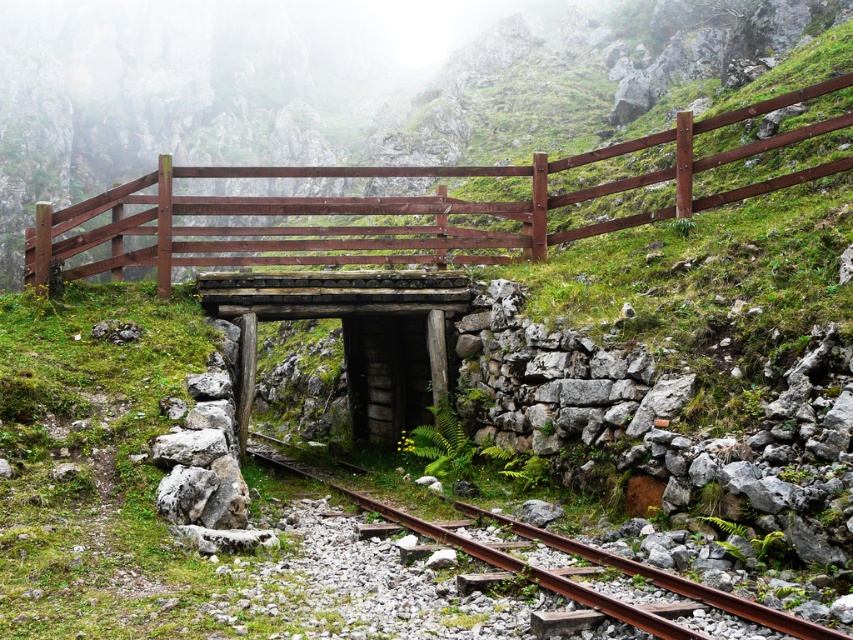
You are a hiker who wants to cross the wooden bridge in the center. The brown wooden fence at center and the rusty metal train track at center are both in your path. Which one is higher and must be navigated first?

The brown wooden fence at center is above the rusty metal train track at center, so you must navigate the brown wooden fence at center first before reaching the train track.

You are a hiker who wants to cross the wooden bridge but needs to know if you can step over the brown wooden fence at center without touching the rusty metal train track at center. Can you do it?

The brown wooden fence at center is taller than the rusty metal train track at center, so you can step over the brown wooden fence at center without touching the rusty metal train track at center.